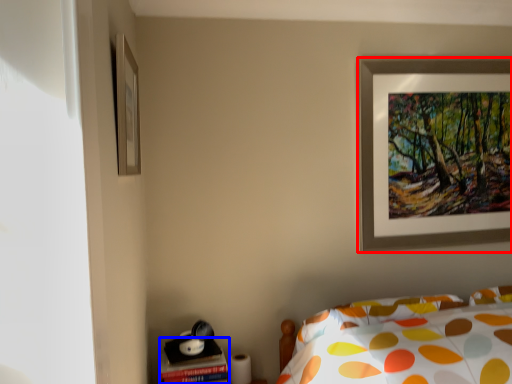
Question: Among these objects, which one is farthest to the camera, picture frame (highlighted by a red box) or table (highlighted by a blue box)?

Choices:
 (A) picture frame
 (B) table

Answer: (A)